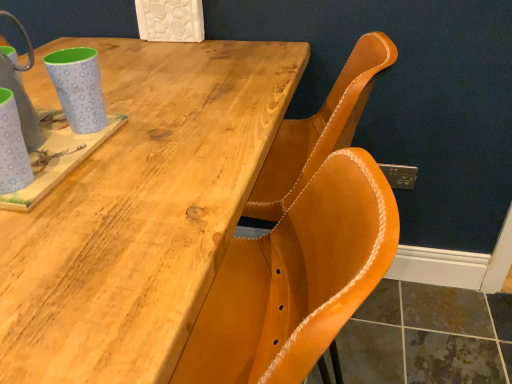
Where is `free space in front of matte blue cup at left, acting as the 1th mug starting from the front`? Image resolution: width=512 pixels, height=384 pixels. free space in front of matte blue cup at left, acting as the 1th mug starting from the front is located at coordinates (38, 251).